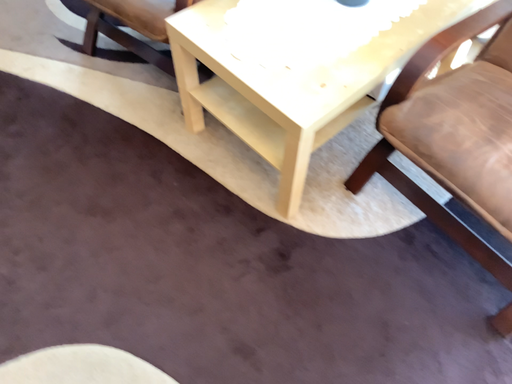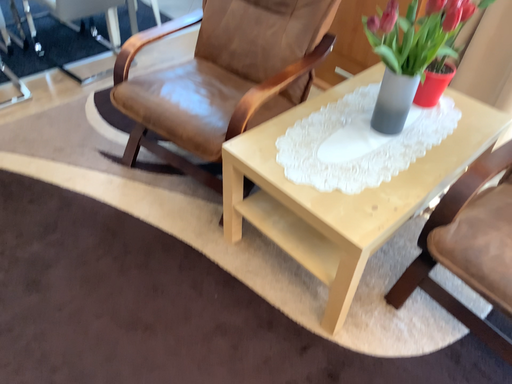
Question: How did the camera likely rotate when shooting the video?

Choices:
 (A) rotated upward
 (B) rotated downward

Answer: (A)